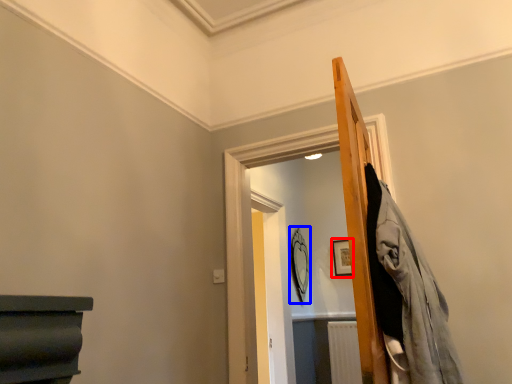
Question: Among these objects, which one is farthest to the camera, picture frame (highlighted by a red box) or mirror (highlighted by a blue box)?

Choices:
 (A) picture frame
 (B) mirror

Answer: (A)